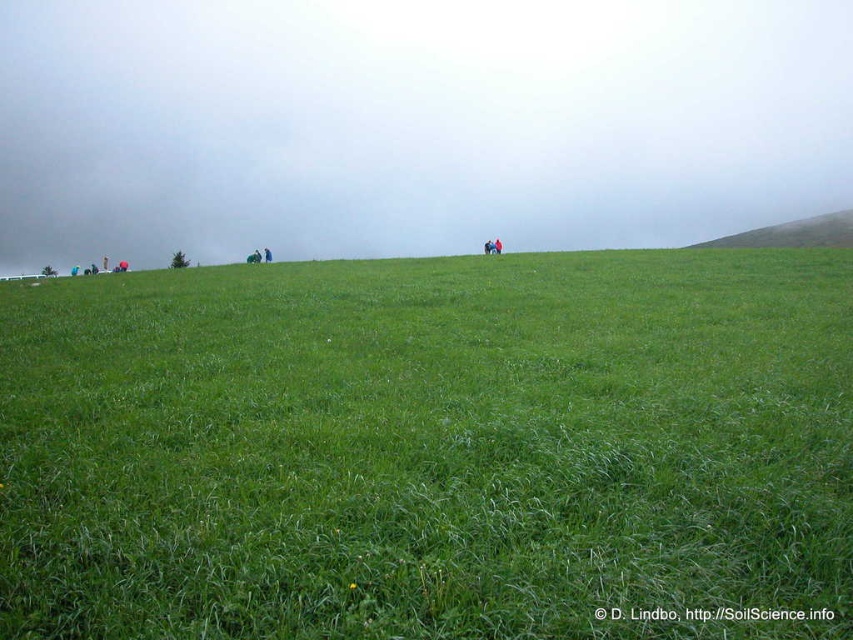
Question: Which point is farther from the camera taking this photo?

Choices:
 (A) (296, 83)
 (B) (492, 419)

Answer: (A)

Question: Which is nearer to the green grass at upper center?

Choices:
 (A) green grassy field at upper center
 (B) green grassy hillside at upper right

Answer: (B)

Question: Based on their relative distances, which object is farther from the green grassy hillside at upper right?

Choices:
 (A) green grassy field at upper center
 (B) green grass at upper center

Answer: (A)

Question: Observing the image, what is the correct spatial positioning of green grassy field at upper center in reference to green grassy hillside at upper right?

Choices:
 (A) right
 (B) left

Answer: (B)

Question: Observing the image, what is the correct spatial positioning of green grassy field at upper center in reference to green grassy hillside at upper right?

Choices:
 (A) below
 (B) above

Answer: (A)

Question: Considering the relative positions of green grassy field at upper center and green grass at upper center in the image provided, where is green grassy field at upper center located with respect to green grass at upper center?

Choices:
 (A) left
 (B) right

Answer: (B)